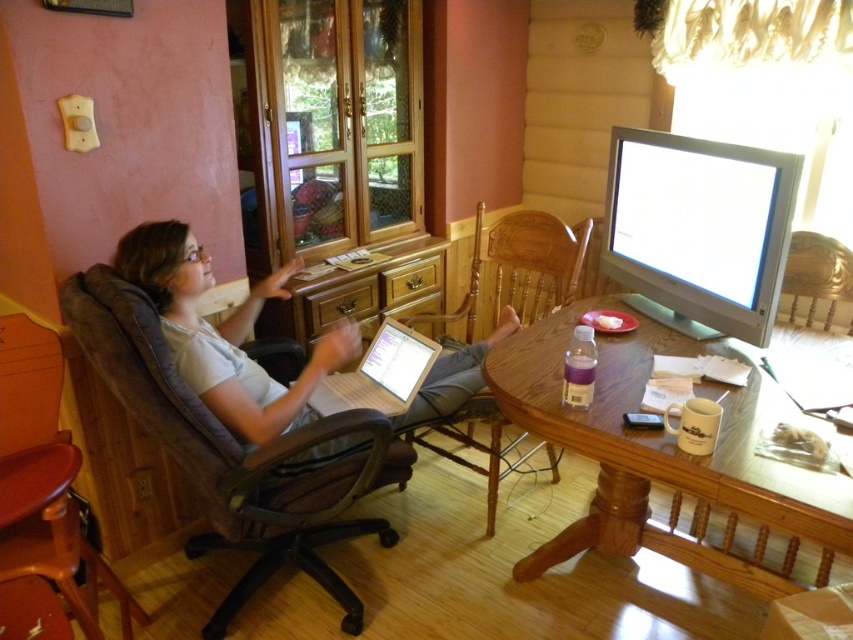
Question: Can you confirm if wooden table at center is thinner than matte gray laptop at center?

Choices:
 (A) no
 (B) yes

Answer: (B)

Question: Which point appears closest to the camera in this image?

Choices:
 (A) (444, 316)
 (B) (720, 545)
 (C) (393, 330)

Answer: (C)

Question: Does brown leather swivel chair at left have a lesser width compared to wooden swivel chair at left?

Choices:
 (A) no
 (B) yes

Answer: (A)

Question: Which object is the closest to the wooden swivel chair at left?

Choices:
 (A) brown leather swivel chair at left
 (B) matte gray laptop at center

Answer: (A)

Question: Which point is closer to the camera taking this photo?

Choices:
 (A) (41, 365)
 (B) (345, 424)
 (C) (306, 410)
 (D) (485, 394)

Answer: (A)

Question: Does brown leather swivel chair at left appear under matte gray laptop at center?

Choices:
 (A) yes
 (B) no

Answer: (A)